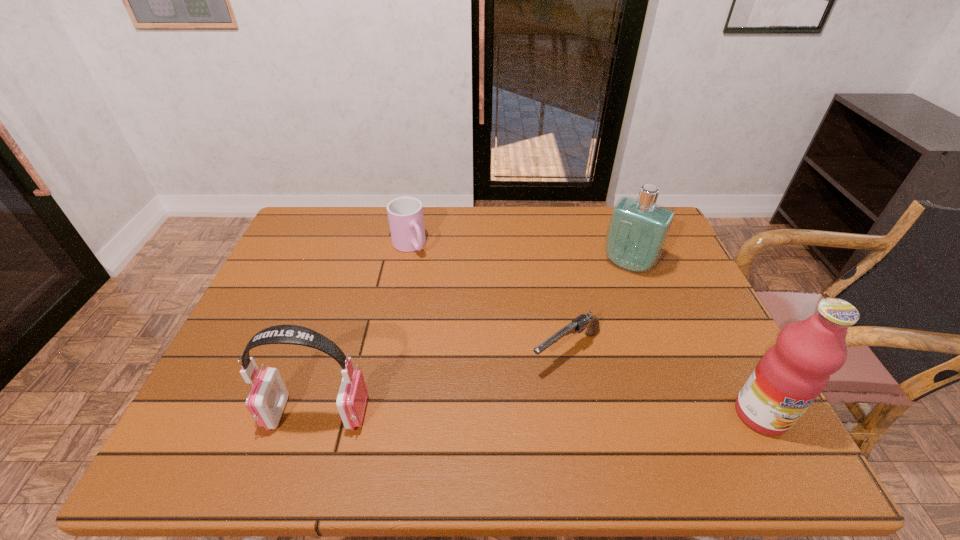
What are the coordinates of `free space that is in between the second shortest object and the earphone` in the screenshot? It's located at (363, 329).

Locate an element on the screen. vacant region between the fourth object from left to right and the earphone is located at coordinates (473, 339).

Identify the location of free space between the second object from right to left and the second shortest object. (519, 255).

Identify which object is located as the fourth nearest to the second shortest object. Please provide its 2D coordinates. Your answer should be formatted as a tuple, i.e. [(x, y)], where the tuple contains the x and y coordinates of a point satisfying the conditions above.

[(792, 373)]

Choose which object is the second nearest neighbor to the second object from right to left. Please provide its 2D coordinates. Your answer should be formatted as a tuple, i.e. [(x, y)], where the tuple contains the x and y coordinates of a point satisfying the conditions above.

[(792, 373)]

Where is `free spot that satisfies the following two spatial constraints: 1. on the front side of the cup; 2. on the left side of the gun`? Image resolution: width=960 pixels, height=540 pixels. free spot that satisfies the following two spatial constraints: 1. on the front side of the cup; 2. on the left side of the gun is located at coordinates [x=389, y=351].